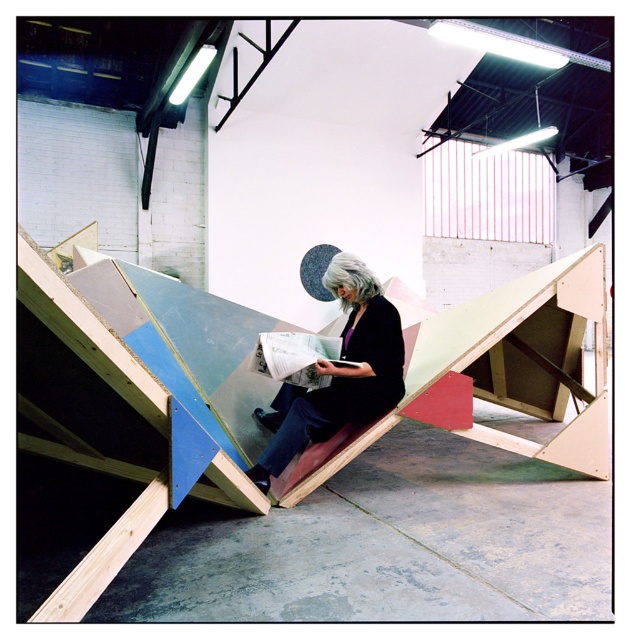
Question: Which point is farther to the camera?

Choices:
 (A) (350, 266)
 (B) (404, 342)

Answer: (B)

Question: Which point is farther to the camera?

Choices:
 (A) (574, 432)
 (B) (375, 365)

Answer: (A)

Question: Considering the relative positions of wooden ramp at center and matte black jacket at center in the image provided, where is wooden ramp at center located with respect to matte black jacket at center?

Choices:
 (A) below
 (B) above

Answer: (B)

Question: Observing the image, what is the correct spatial positioning of wooden ramp at center in reference to matte black jacket at center?

Choices:
 (A) below
 (B) above

Answer: (B)

Question: Considering the relative positions of wooden ramp at center and matte black jacket at center in the image provided, where is wooden ramp at center located with respect to matte black jacket at center?

Choices:
 (A) above
 (B) below

Answer: (A)